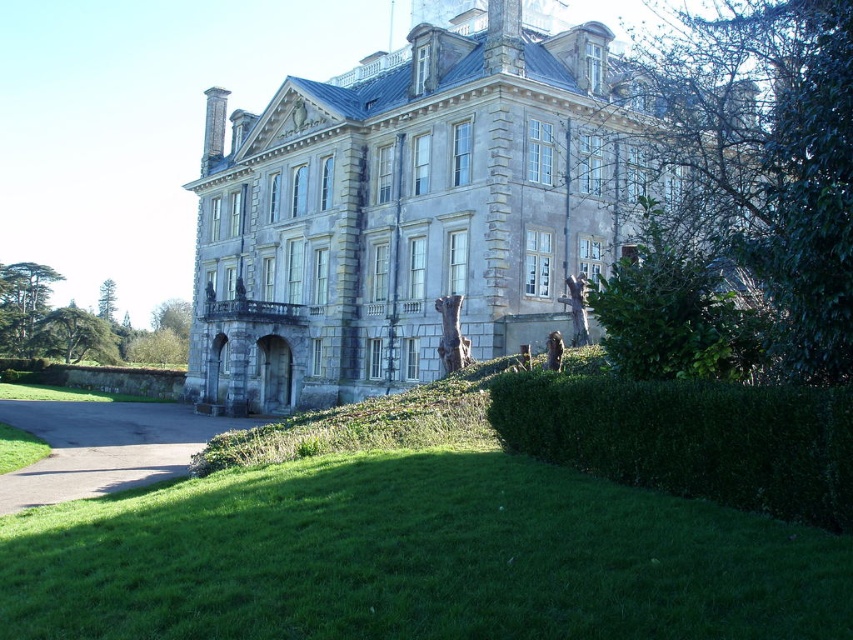
You are a gardener who needs to mow the lawn. You see the green grass at lower center and the green leafy hedge at lower right in the scene. Which area requires immediate attention for trimming, based on their current height?

The green leafy hedge at lower right requires immediate attention because it is taller than the green grass at lower center, which is shorter and likely needs mowing first.

You are standing at the point marked as point [415,557] in the grand historic building scene. What surface are you currently standing on?

You are standing on green grass at lower center.